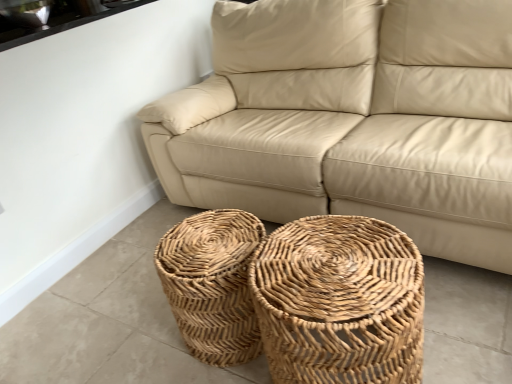
Question: Considering the relative sizes of beige leather couch at center and white glossy window sill at upper left in the image provided, is beige leather couch at center wider than white glossy window sill at upper left?

Choices:
 (A) no
 (B) yes

Answer: (B)

Question: Can you confirm if beige leather couch at center is thinner than white glossy window sill at upper left?

Choices:
 (A) no
 (B) yes

Answer: (A)

Question: From the image's perspective, is beige leather couch at center located above white glossy window sill at upper left?

Choices:
 (A) no
 (B) yes

Answer: (A)

Question: Does beige leather couch at center have a lesser height compared to white glossy window sill at upper left?

Choices:
 (A) yes
 (B) no

Answer: (B)

Question: Is beige leather couch at center to the left of white glossy window sill at upper left from the viewer's perspective?

Choices:
 (A) no
 (B) yes

Answer: (A)

Question: Is point (422, 99) positioned closer to the camera than point (207, 336)?

Choices:
 (A) closer
 (B) farther

Answer: (B)

Question: From their relative heights in the image, would you say beige leather couch at center is taller or shorter than natural woven baskets at center, the 2th basket in the right-to-left sequence?

Choices:
 (A) short
 (B) tall

Answer: (B)

Question: Visually, is beige leather couch at center positioned to the left or to the right of natural woven baskets at center, the 2th basket in the right-to-left sequence?

Choices:
 (A) right
 (B) left

Answer: (A)

Question: Is beige leather couch at center wider or thinner than natural woven baskets at center, which is counted as the first basket, starting from the left?

Choices:
 (A) thin
 (B) wide

Answer: (B)

Question: From the image's perspective, is natural woven basket at center, positioned as the 2th basket in left-to-right order, positioned above or below beige leather couch at center?

Choices:
 (A) above
 (B) below

Answer: (B)

Question: From a real-world perspective, is natural woven basket at center, the 1th basket viewed from the right, physically located above or below beige leather couch at center?

Choices:
 (A) below
 (B) above

Answer: (A)

Question: Considering the positions of point (349, 374) and point (234, 135), is point (349, 374) closer or farther from the camera than point (234, 135)?

Choices:
 (A) closer
 (B) farther

Answer: (A)

Question: Looking at their shapes, would you say natural woven basket at center, positioned as the 2th basket in left-to-right order, is wider or thinner than beige leather couch at center?

Choices:
 (A) wide
 (B) thin

Answer: (B)

Question: Is white glossy window sill at upper left bigger or smaller than natural woven basket at center, the 1th basket viewed from the right?

Choices:
 (A) big
 (B) small

Answer: (B)

Question: From the image's perspective, is white glossy window sill at upper left above or below natural woven basket at center, the 1th basket viewed from the right?

Choices:
 (A) above
 (B) below

Answer: (A)